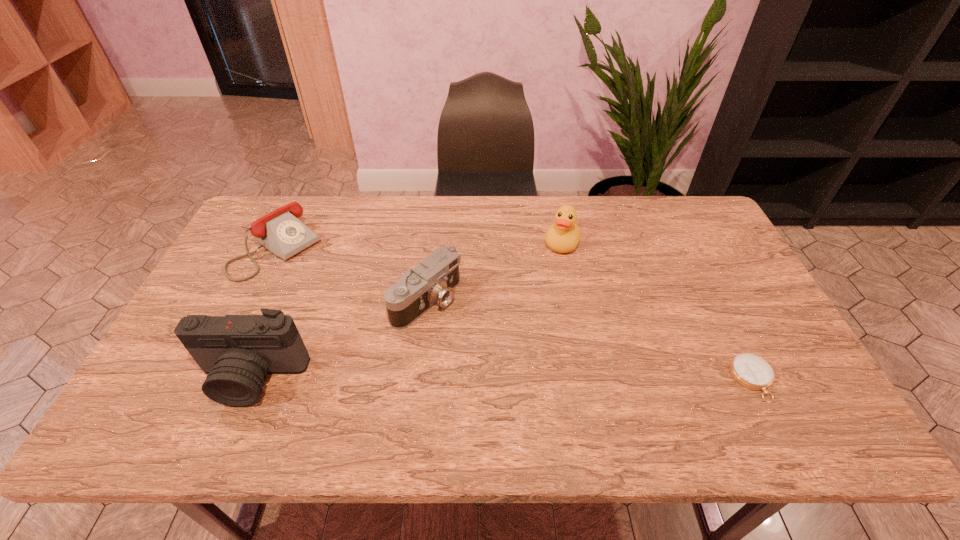
Where is `free spot located on the lens of the third object from left to right`? This screenshot has width=960, height=540. free spot located on the lens of the third object from left to right is located at coordinates click(471, 332).

Locate an element on the screen. The height and width of the screenshot is (540, 960). vacant space located 0.090m on the lens of the third object from left to right is located at coordinates (477, 335).

This screenshot has height=540, width=960. Identify the location of free region located at the beak of the fourth object from left to right. tap(536, 313).

Image resolution: width=960 pixels, height=540 pixels. What are the coordinates of `vacant space located at the beak of the fourth object from left to right` in the screenshot? It's located at (521, 349).

At what (x,y) coordinates should I click in order to perform the action: click on vacant space situated at the beak of the fourth object from left to right. Please return your answer as a coordinate pair (x, y). The image size is (960, 540). Looking at the image, I should click on (533, 321).

Identify the location of vacant area situated on the dial of the telephone. (316, 282).

Find the location of a particular element. free space located on the dial of the telephone is located at coordinates 320,285.

Locate an element on the screen. Image resolution: width=960 pixels, height=540 pixels. free spot located 0.210m on the dial of the telephone is located at coordinates (343, 303).

You are a GUI agent. You are given a task and a screenshot of the screen. Output one action in this format:
    pyautogui.click(x=<x>, y=<y>)
    Task: Click on the duck at the far edge
    This screenshot has width=960, height=540.
    Given the screenshot: What is the action you would take?
    pyautogui.click(x=563, y=236)

The image size is (960, 540). In order to click on telephone present at the far edge in this screenshot , I will do `click(281, 232)`.